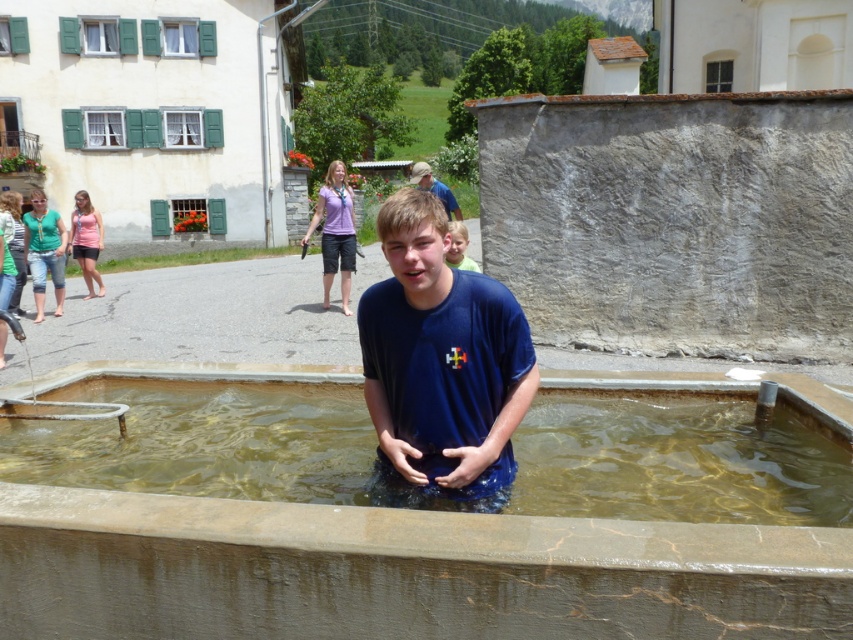
Does clear concrete water at center have a lesser height compared to light brown hair at upper right?

No, clear concrete water at center is not shorter than light brown hair at upper right.

Between clear concrete water at center and light brown hair at upper right, which one has more height?

clear concrete water at center

Who is more forward, (785, 508) or (447, 224)?

Positioned in front is point (447, 224).

Locate an element on the screen. The height and width of the screenshot is (640, 853). clear concrete water at center is located at coordinates (677, 460).

Is clear concrete water at center further to the viewer compared to blue matte shirt at center?

That is True.

Is clear concrete water at center closer to the viewer compared to blue matte shirt at center?

No, it is not.

Who is more distant from viewer, (611, 438) or (431, 406)?

Point (611, 438)

Locate an element on the screen. The width and height of the screenshot is (853, 640). clear concrete water at center is located at coordinates (677, 460).

Is point (422, 244) farther from camera compared to point (474, 269)?

No, (422, 244) is closer to viewer.

Image resolution: width=853 pixels, height=640 pixels. Describe the element at coordinates (440, 362) in the screenshot. I see `blue matte shirt at center` at that location.

Find the location of a particular element. blue matte shirt at center is located at coordinates (440, 362).